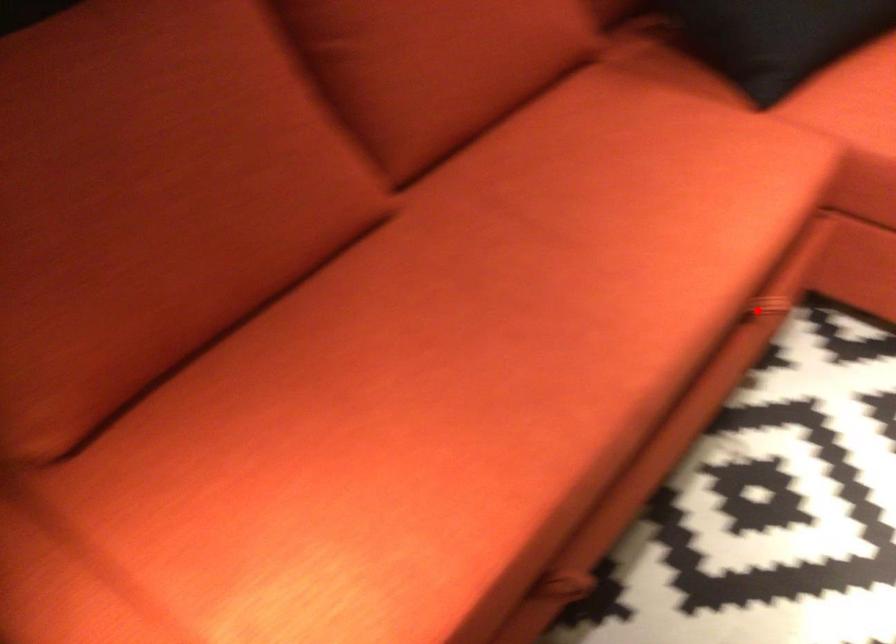
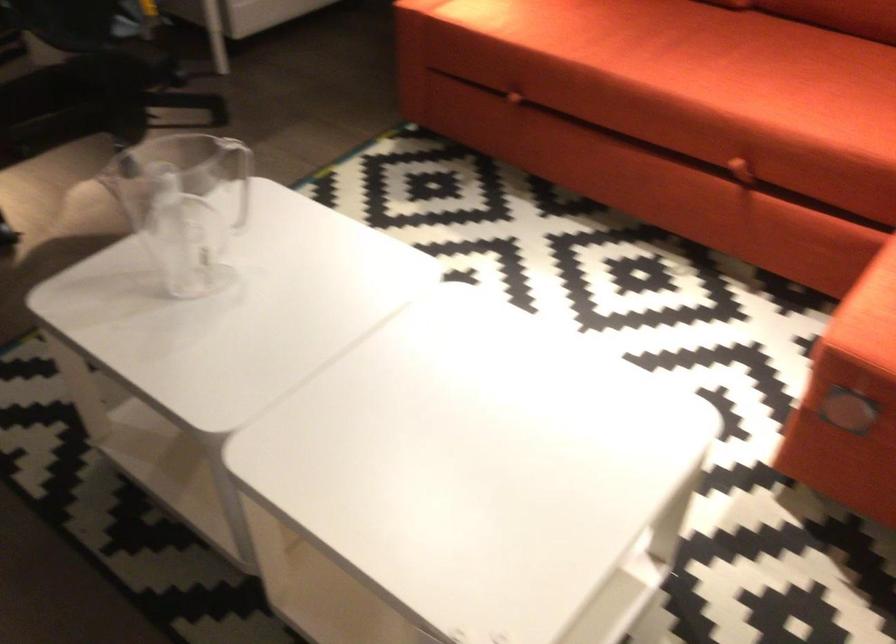
Where in the second image is the point corresponding to the highlighted location from the first image?

(737, 160)